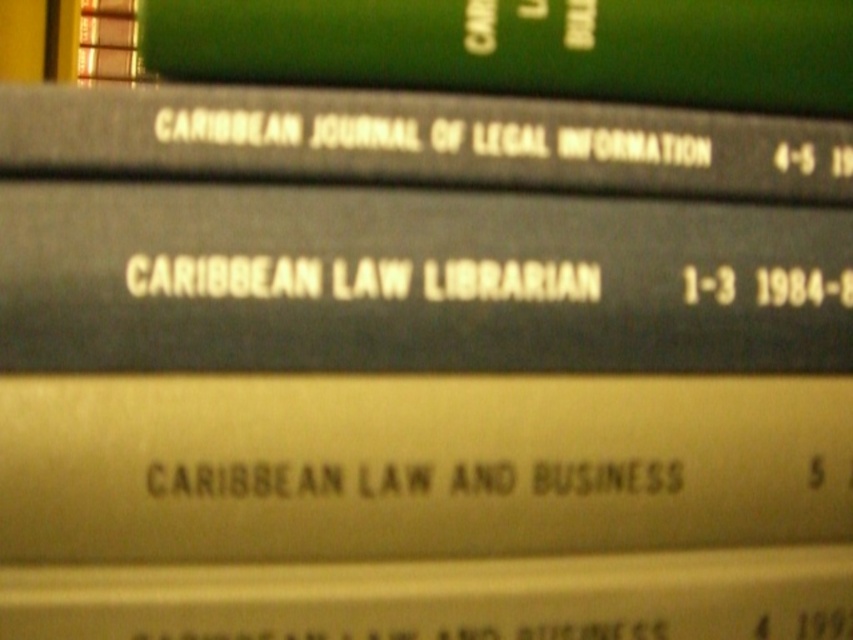
Question: Is black matte book at upper center wider than yellow matte book at center?

Choices:
 (A) yes
 (B) no

Answer: (A)

Question: Which point is closer to the camera?

Choices:
 (A) black matte book at upper center
 (B) matte gold book at center
 (C) black matte book at center
 (D) yellow matte book at center

Answer: (C)

Question: From the image, what is the correct spatial relationship of black matte book at upper center in relation to yellow matte book at center?

Choices:
 (A) below
 (B) above

Answer: (B)

Question: Which point is closer to the camera?

Choices:
 (A) yellow matte book at center
 (B) black matte book at upper center
 (C) matte gold book at center
 (D) green matte book at upper center

Answer: (B)

Question: Which point is farther from the camera taking this photo?

Choices:
 (A) (850, 38)
 (B) (549, 429)
 (C) (614, 609)

Answer: (A)

Question: Does black matte book at center have a smaller size compared to yellow matte book at center?

Choices:
 (A) yes
 (B) no

Answer: (B)